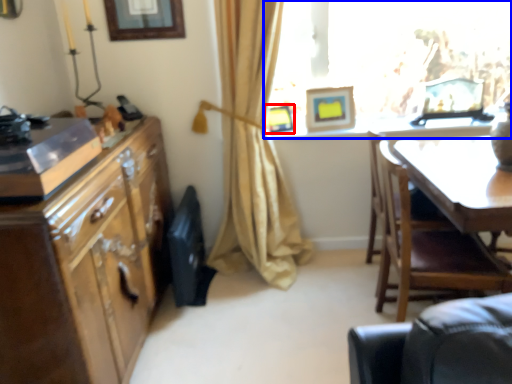
Question: Among these objects, which one is farthest to the camera, picture frame (highlighted by a red box) or window (highlighted by a blue box)?

Choices:
 (A) picture frame
 (B) window

Answer: (A)